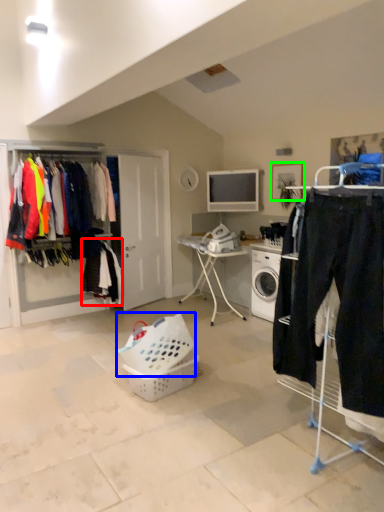
Question: Considering the real-world distances, which object is farthest from clothing (highlighted by a red box)? basket (highlighted by a blue box) or picture frame (highlighted by a green box)?

Choices:
 (A) basket
 (B) picture frame

Answer: (B)